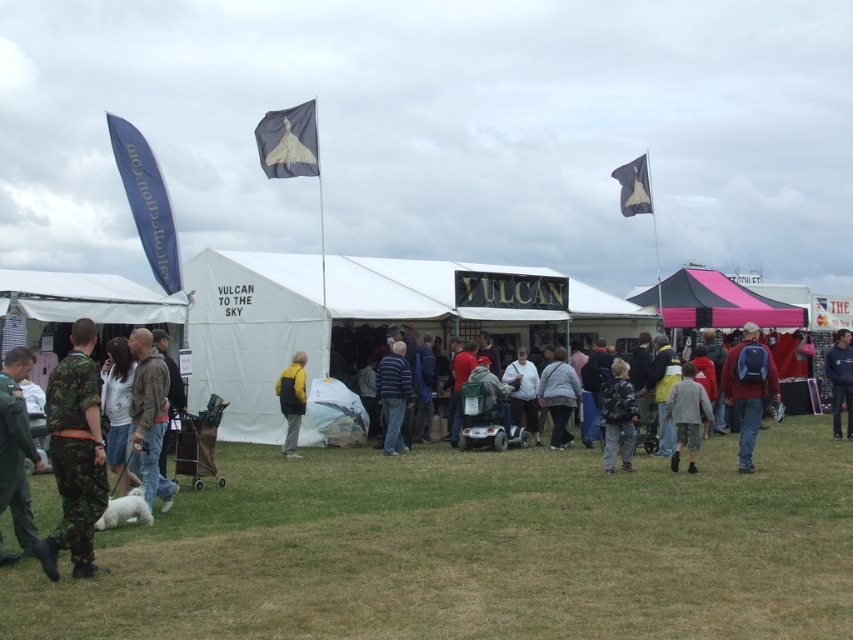
Question: Which point is farther to the camera?

Choices:
 (A) yellow matte jacket at center
 (B) blue fabric flag at upper left

Answer: (B)

Question: Does dark red backpack at right have a greater width compared to camouflage pants at center?

Choices:
 (A) no
 (B) yes

Answer: (A)

Question: Which point appears farthest from the camera in this image?

Choices:
 (A) (144, 410)
 (B) (688, 445)

Answer: (B)

Question: Among these objects, which one is farthest from the camera?

Choices:
 (A) gray fabric jacket at center
 (B) striped sweater at center

Answer: (A)

Question: Is blue fabric flag at upper left to the left of dark blue fabric flag at upper center from the viewer's perspective?

Choices:
 (A) yes
 (B) no

Answer: (A)

Question: Does blue fabric flag at upper left have a smaller size compared to yellow matte jacket at center?

Choices:
 (A) yes
 (B) no

Answer: (B)